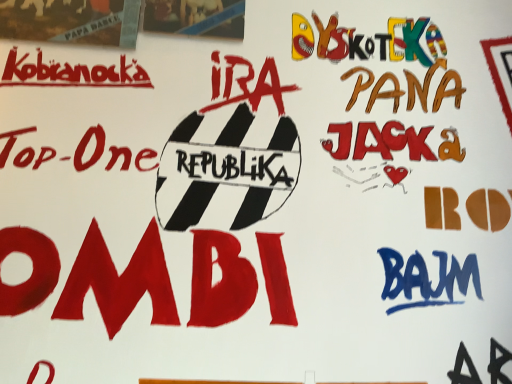
Measure the distance between point (219,22) and camera.

The depth of point (219,22) is 1.03 meters.

Describe the element at coordinates (195, 17) in the screenshot. The width and height of the screenshot is (512, 384). I see `matte cardboard poster at upper left, which is the second poster in left-to-right order` at that location.

This screenshot has width=512, height=384. Identify the location of matte cardboard poster at upper left, which is the second poster in left-to-right order. (195, 17).

You are a GUI agent. You are given a task and a screenshot of the screen. Output one action in this format:
    pyautogui.click(x=<x>, y=<y>)
    Task: Click on the matte cardboard poster at upper left, the 1th poster when ordered from left to right
    The width and height of the screenshot is (512, 384).
    Given the screenshot: What is the action you would take?
    pyautogui.click(x=71, y=21)

In order to face matte cardboard poster at upper left, the 1th poster when ordered from left to right, should I rotate leftwards or rightwards?

A 24.004 degree turn to the left will do.

What do you see at coordinates (71, 21) in the screenshot?
I see `matte cardboard poster at upper left, the 1th poster when ordered from left to right` at bounding box center [71, 21].

At what (x,y) coordinates should I click in order to perform the action: click on matte cardboard poster at upper left, acting as the 1th poster starting from the right. Please return your answer as a coordinate pair (x, y). Image resolution: width=512 pixels, height=384 pixels. Looking at the image, I should click on (195, 17).

Is matte cardboard poster at upper left, acting as the 1th poster starting from the right, to the left of matte cardboard poster at upper left, the second poster in the right-to-left sequence, from the viewer's perspective?

No, matte cardboard poster at upper left, acting as the 1th poster starting from the right, is not to the left of matte cardboard poster at upper left, the second poster in the right-to-left sequence.

Is matte cardboard poster at upper left, acting as the 1th poster starting from the right, further to camera compared to matte cardboard poster at upper left, the 1th poster when ordered from left to right?

Yes, it is behind matte cardboard poster at upper left, the 1th poster when ordered from left to right.

Which is closer, (225,6) or (24,14)?

Point (225,6) is farther from the camera than point (24,14).

From the image's perspective, is matte cardboard poster at upper left, acting as the 1th poster starting from the right, over matte cardboard poster at upper left, the second poster in the right-to-left sequence?

Yes, from the image's perspective, matte cardboard poster at upper left, acting as the 1th poster starting from the right, is above matte cardboard poster at upper left, the second poster in the right-to-left sequence.

From a real-world perspective, is matte cardboard poster at upper left, acting as the 1th poster starting from the right, located beneath matte cardboard poster at upper left, the 1th poster when ordered from left to right?

Actually, matte cardboard poster at upper left, acting as the 1th poster starting from the right, is physically above matte cardboard poster at upper left, the 1th poster when ordered from left to right, in the real world.

Considering the relative sizes of matte cardboard poster at upper left, acting as the 1th poster starting from the right, and matte cardboard poster at upper left, the second poster in the right-to-left sequence, in the image provided, is matte cardboard poster at upper left, acting as the 1th poster starting from the right, wider than matte cardboard poster at upper left, the second poster in the right-to-left sequence,?

Correct, the width of matte cardboard poster at upper left, acting as the 1th poster starting from the right, exceeds that of matte cardboard poster at upper left, the second poster in the right-to-left sequence.

Looking at this image, can you confirm if matte cardboard poster at upper left, which is the second poster in left-to-right order, is shorter than matte cardboard poster at upper left, the 1th poster when ordered from left to right?

Yes, matte cardboard poster at upper left, which is the second poster in left-to-right order, is shorter than matte cardboard poster at upper left, the 1th poster when ordered from left to right.

Between matte cardboard poster at upper left, which is the second poster in left-to-right order, and matte cardboard poster at upper left, the 1th poster when ordered from left to right, which one has smaller size?

matte cardboard poster at upper left, which is the second poster in left-to-right order, is smaller.

Is matte cardboard poster at upper left, the 1th poster when ordered from left to right, completely or partially inside matte cardboard poster at upper left, which is the second poster in left-to-right order?

Actually, matte cardboard poster at upper left, the 1th poster when ordered from left to right, is outside matte cardboard poster at upper left, which is the second poster in left-to-right order.

Based on the photo, is matte cardboard poster at upper left, which is the second poster in left-to-right order, in contact with matte cardboard poster at upper left, the second poster in the right-to-left sequence?

matte cardboard poster at upper left, which is the second poster in left-to-right order, and matte cardboard poster at upper left, the second poster in the right-to-left sequence, are clearly separated.

Is matte cardboard poster at upper left, which is the second poster in left-to-right order, oriented away from matte cardboard poster at upper left, the 1th poster when ordered from left to right?

No, matte cardboard poster at upper left, which is the second poster in left-to-right order,'s orientation is not away from matte cardboard poster at upper left, the 1th poster when ordered from left to right.

Can you tell me how much matte cardboard poster at upper left, which is the second poster in left-to-right order, and matte cardboard poster at upper left, the second poster in the right-to-left sequence, differ in facing direction?

They differ by 0.000685 degrees in their facing directions.

Locate an element on the screen. The height and width of the screenshot is (384, 512). poster lying on the right of matte cardboard poster at upper left, the second poster in the right-to-left sequence is located at coordinates (195, 17).

Is matte cardboard poster at upper left, the second poster in the right-to-left sequence, at the left side of matte cardboard poster at upper left, acting as the 1th poster starting from the right?

Yes.

Between matte cardboard poster at upper left, the second poster in the right-to-left sequence, and matte cardboard poster at upper left, acting as the 1th poster starting from the right, which one is positioned in front?

matte cardboard poster at upper left, the second poster in the right-to-left sequence.

Between point (128, 15) and point (197, 8), which one is positioned in front?

Positioned in front is point (128, 15).

From the picture: From the image's perspective, is matte cardboard poster at upper left, the 1th poster when ordered from left to right, beneath matte cardboard poster at upper left, which is the second poster in left-to-right order?

Indeed, from the image's perspective, matte cardboard poster at upper left, the 1th poster when ordered from left to right, is shown beneath matte cardboard poster at upper left, which is the second poster in left-to-right order.

From a real-world perspective, does matte cardboard poster at upper left, the 1th poster when ordered from left to right, sit lower than matte cardboard poster at upper left, which is the second poster in left-to-right order?

Yes.

In terms of width, does matte cardboard poster at upper left, the second poster in the right-to-left sequence, look wider or thinner when compared to matte cardboard poster at upper left, which is the second poster in left-to-right order?

Considering their sizes, matte cardboard poster at upper left, the second poster in the right-to-left sequence, looks slimmer than matte cardboard poster at upper left, which is the second poster in left-to-right order.

Which of these two, matte cardboard poster at upper left, the second poster in the right-to-left sequence, or matte cardboard poster at upper left, acting as the 1th poster starting from the right, stands taller?

With more height is matte cardboard poster at upper left, the second poster in the right-to-left sequence.

Who is smaller, matte cardboard poster at upper left, the 1th poster when ordered from left to right, or matte cardboard poster at upper left, acting as the 1th poster starting from the right?

matte cardboard poster at upper left, acting as the 1th poster starting from the right.

Does matte cardboard poster at upper left, the second poster in the right-to-left sequence, contain matte cardboard poster at upper left, which is the second poster in left-to-right order?

Definitely not — matte cardboard poster at upper left, which is the second poster in left-to-right order, is not inside matte cardboard poster at upper left, the second poster in the right-to-left sequence.

Can you see matte cardboard poster at upper left, the 1th poster when ordered from left to right, touching matte cardboard poster at upper left, which is the second poster in left-to-right order?

matte cardboard poster at upper left, the 1th poster when ordered from left to right, is not next to matte cardboard poster at upper left, which is the second poster in left-to-right order, and they're not touching.

Could you tell me if matte cardboard poster at upper left, the 1th poster when ordered from left to right, is turned towards matte cardboard poster at upper left, which is the second poster in left-to-right order?

No, matte cardboard poster at upper left, the 1th poster when ordered from left to right, is not oriented towards matte cardboard poster at upper left, which is the second poster in left-to-right order.

The height and width of the screenshot is (384, 512). In the image, there is a matte cardboard poster at upper left, the 1th poster when ordered from left to right. What are the coordinates of `poster above it (from the image's perspective)` in the screenshot? It's located at 195,17.

Where is `poster above the matte cardboard poster at upper left, the 1th poster when ordered from left to right (from a real-world perspective)`? The image size is (512, 384). poster above the matte cardboard poster at upper left, the 1th poster when ordered from left to right (from a real-world perspective) is located at coordinates [195, 17].

Locate an element on the screen. The width and height of the screenshot is (512, 384). poster lying on the left of matte cardboard poster at upper left, which is the second poster in left-to-right order is located at coordinates (71, 21).